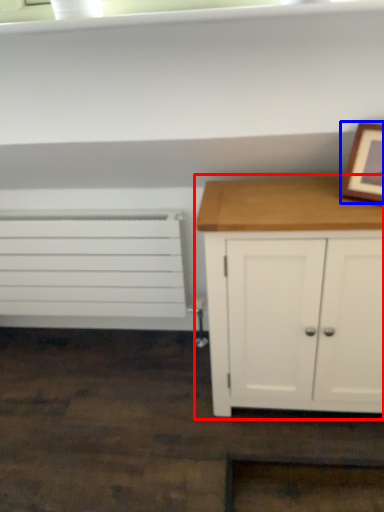
Question: Which of the following is the farthest to the observer, chest of drawers (highlighted by a red box) or picture frame (highlighted by a blue box)?

Choices:
 (A) chest of drawers
 (B) picture frame

Answer: (A)